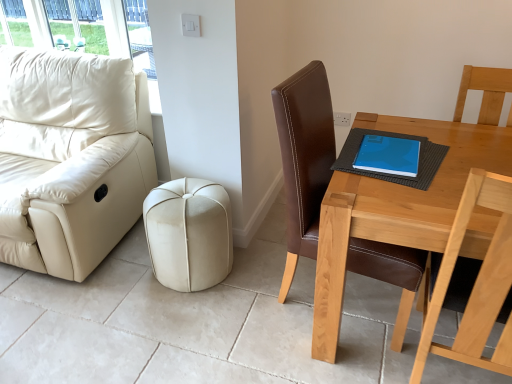
Image resolution: width=512 pixels, height=384 pixels. What are the coordinates of `brown leather chair at right` in the screenshot? It's located at (304, 158).

What do you see at coordinates (189, 233) in the screenshot? I see `beige leather ottoman at center` at bounding box center [189, 233].

This screenshot has height=384, width=512. What are the coordinates of `brown leather chair at right` in the screenshot? It's located at (304, 158).

Is matte cream leather couch at left completely or partially inside blue matte notebook at table?

That's incorrect, matte cream leather couch at left is not inside blue matte notebook at table.

Consider the image. Can you confirm if blue matte notebook at table is positioned to the left of matte cream leather couch at left?

Incorrect, blue matte notebook at table is not on the left side of matte cream leather couch at left.

In the scene shown: Is blue matte notebook at table facing towards matte cream leather couch at left?

No, blue matte notebook at table is not facing towards matte cream leather couch at left.

Which object is thinner, blue matte notebook at table or light brown wooden table at right?

With smaller width is blue matte notebook at table.

Which of these two, blue matte notebook at table or light brown wooden table at right, stands taller?

Standing taller between the two is light brown wooden table at right.

Consider the image. Could you tell me if blue matte notebook at table is facing light brown wooden table at right?

Yes, blue matte notebook at table is oriented towards light brown wooden table at right.

Considering the positions of points (401, 159) and (396, 238), is point (401, 159) farther from camera compared to point (396, 238)?

Yes, it is.

From the image's perspective, which one is positioned lower, brown leather chair at right or beige leather ottoman at center?

beige leather ottoman at center.

Considering the relative positions of brown leather chair at right and beige leather ottoman at center in the image provided, is brown leather chair at right to the left of beige leather ottoman at center from the viewer's perspective?

Incorrect, brown leather chair at right is not on the left side of beige leather ottoman at center.

From a real-world perspective, between brown leather chair at right and beige leather ottoman at center, who is vertically lower?

beige leather ottoman at center, from a real-world perspective.

Between brown leather chair at right and beige leather ottoman at center, which one has larger size?

brown leather chair at right.

Is matte cream leather couch at left inside the boundaries of blue matte notebook at table, or outside?

matte cream leather couch at left cannot be found inside blue matte notebook at table.

In the scene shown: Considering the positions of objects matte cream leather couch at left and blue matte notebook at table in the image provided, who is more to the right, matte cream leather couch at left or blue matte notebook at table?

Positioned to the right is blue matte notebook at table.

From the image's perspective, is matte cream leather couch at left below blue matte notebook at table?

No.

Which object is wider, matte cream leather couch at left or brown leather chair at right?

With larger width is matte cream leather couch at left.

How far apart are matte cream leather couch at left and brown leather chair at right?

matte cream leather couch at left and brown leather chair at right are 3.88 feet apart.

Is point (105, 89) in front of point (381, 243)?

No, (105, 89) is behind (381, 243).

Locate an element on the screen. This screenshot has height=384, width=512. studio couch above the brown leather chair at right (from the image's perspective) is located at coordinates (71, 157).

From the image's perspective, would you say blue matte book at upper right is positioned over light brown wooden table at right?

Yes, from the image's perspective, blue matte book at upper right is on top of light brown wooden table at right.

Is blue matte book at upper right positioned in front of light brown wooden table at right?

No.

This screenshot has height=384, width=512. I want to click on table on the right of blue matte book at upper right, so click(396, 208).

Does blue matte book at upper right turn towards light brown wooden table at right?

No, blue matte book at upper right is not facing towards light brown wooden table at right.

Is blue matte book at upper right facing away from beige leather ottoman at center?

No, beige leather ottoman at center is not at the back of blue matte book at upper right.

Can you tell me how much blue matte book at upper right and beige leather ottoman at center differ in facing direction?

blue matte book at upper right and beige leather ottoman at center are facing 0.276 degrees away from each other.

Can you confirm if blue matte book at upper right is shorter than beige leather ottoman at center?

Yes, blue matte book at upper right is shorter than beige leather ottoman at center.

Considering the sizes of objects blue matte book at upper right and beige leather ottoman at center in the image provided, who is wider, blue matte book at upper right or beige leather ottoman at center?

With larger width is beige leather ottoman at center.

Where is `notebook that appears below the matte cream leather couch at left (from the image's perspective)`? notebook that appears below the matte cream leather couch at left (from the image's perspective) is located at coordinates click(x=391, y=157).

At what (x,y) coordinates should I click in order to perform the action: click on table that appears in front of the blue matte notebook at table. Please return your answer as a coordinate pair (x, y). Looking at the image, I should click on (396, 208).

Which object lies further to the anchor point blue matte notebook at table, brown leather chair at right or matte cream leather couch at left?

The object further to blue matte notebook at table is matte cream leather couch at left.

Considering their positions, is blue matte notebook at table positioned closer to matte cream leather couch at left than blue matte book at upper right?

blue matte notebook at table is positioned closer to the anchor matte cream leather couch at left.

Looking at the image, which one is located closer to beige leather ottoman at center, matte cream leather couch at left or brown leather chair at right?

brown leather chair at right is closer to beige leather ottoman at center.

Considering their positions, is blue matte notebook at table positioned further to brown leather chair at right than light brown wooden table at right?

Among the two, light brown wooden table at right is located further to brown leather chair at right.

Looking at the image, which one is located further to blue matte book at upper right, blue matte notebook at table or brown leather chair at right?

Among the two, brown leather chair at right is located further to blue matte book at upper right.

Looking at the image, which one is located further to matte cream leather couch at left, beige leather ottoman at center or blue matte notebook at table?

blue matte notebook at table is positioned further to the anchor matte cream leather couch at left.

Based on their spatial positions, is light brown wooden table at right or blue matte book at upper right further from blue matte notebook at table?

light brown wooden table at right is further to blue matte notebook at table.

Estimate the real-world distances between objects in this image. Which object is closer to blue matte notebook at table, matte cream leather couch at left or brown leather chair at right?

brown leather chair at right lies closer to blue matte notebook at table than the other object.

Where is `notebook between blue matte book at upper right and light brown wooden table at right in the up-down direction`? notebook between blue matte book at upper right and light brown wooden table at right in the up-down direction is located at coordinates (391, 157).

Identify the location of notebook located between beige leather ottoman at center and light brown wooden table at right in the left-right direction. The image size is (512, 384). (391, 157).

Where is `tablet computer between beige leather ottoman at center and light brown wooden table at right in the horizontal direction`? This screenshot has height=384, width=512. tablet computer between beige leather ottoman at center and light brown wooden table at right in the horizontal direction is located at coordinates (388, 155).

This screenshot has width=512, height=384. Find the location of `chair between light brown wooden table at right and blue matte book at upper right in the front-back direction`. chair between light brown wooden table at right and blue matte book at upper right in the front-back direction is located at coordinates (304, 158).